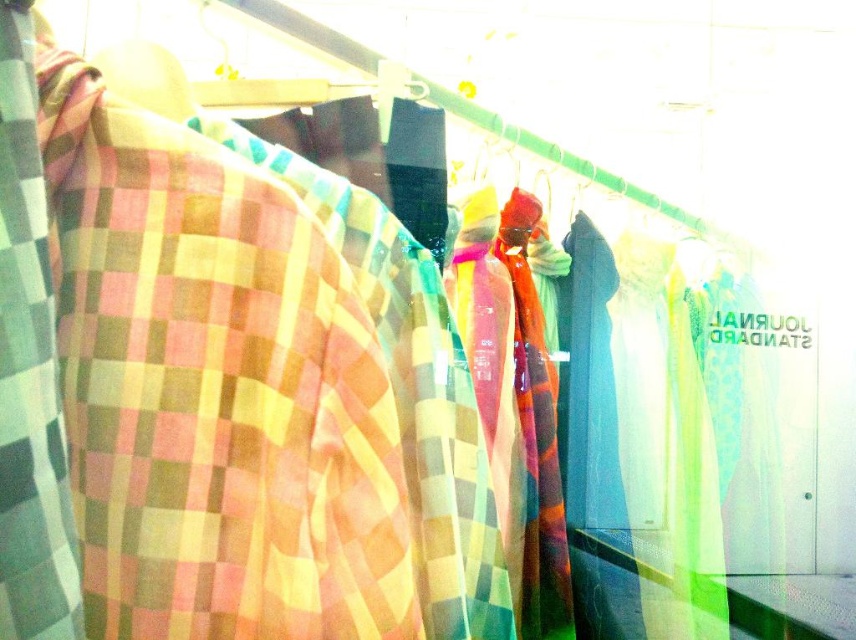
Question: Which of the following is the farthest from the observer?

Choices:
 (A) (146, 634)
 (B) (46, 358)

Answer: (A)

Question: Is checkered fabric at left positioned in front of translucent multicolored scarf at center?

Choices:
 (A) no
 (B) yes

Answer: (B)

Question: Is checkered fabric shirt at center to the left of translucent multicolored scarf at center from the viewer's perspective?

Choices:
 (A) yes
 (B) no

Answer: (A)

Question: Estimate the real-world distances between objects in this image. Which object is farther from the checkered fabric shirt at left?

Choices:
 (A) translucent multicolored scarf at center
 (B) checkered fabric at left
 (C) checkered fabric shirt at center

Answer: (A)

Question: Can you confirm if checkered fabric shirt at left is smaller than translucent multicolored scarf at center?

Choices:
 (A) no
 (B) yes

Answer: (B)

Question: Estimate the real-world distances between objects in this image. Which object is farther from the checkered fabric shirt at center?

Choices:
 (A) checkered fabric at left
 (B) translucent multicolored scarf at center
 (C) checkered fabric shirt at left

Answer: (A)